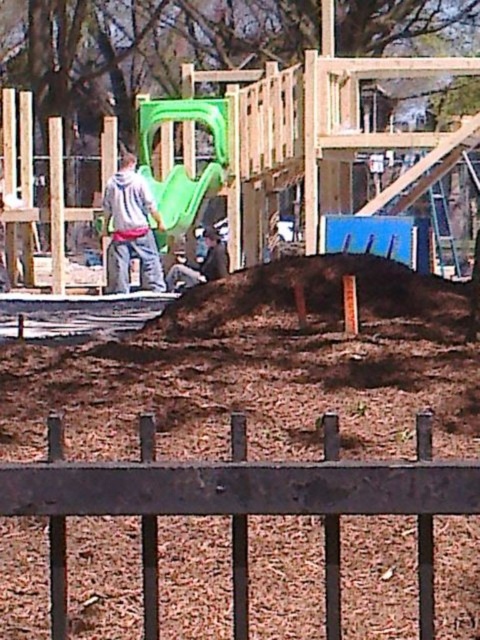
Is black wrought iron fence at lower center taller than brown mulch at center?

No, black wrought iron fence at lower center is not taller than brown mulch at center.

Between black wrought iron fence at lower center and brown mulch at center, which one has more height?

brown mulch at center is taller.

You are a GUI agent. You are given a task and a screenshot of the screen. Output one action in this format:
    pyautogui.click(x=<x>, y=<y>)
    Task: Click on the black wrought iron fence at lower center
    The width and height of the screenshot is (480, 640).
    Given the screenshot: What is the action you would take?
    pyautogui.click(x=240, y=506)